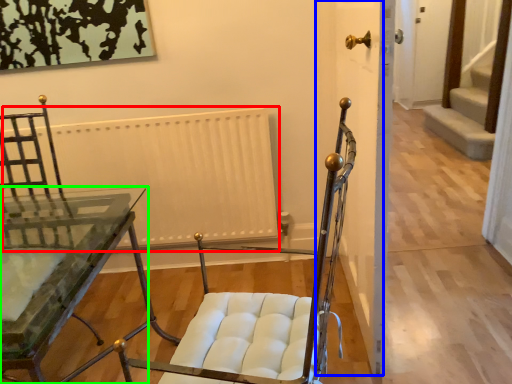
Question: Which object is the closest to the radiator (highlighted by a red box)? Choose among these: door (highlighted by a blue box) or table (highlighted by a green box).

Choices:
 (A) door
 (B) table

Answer: (B)